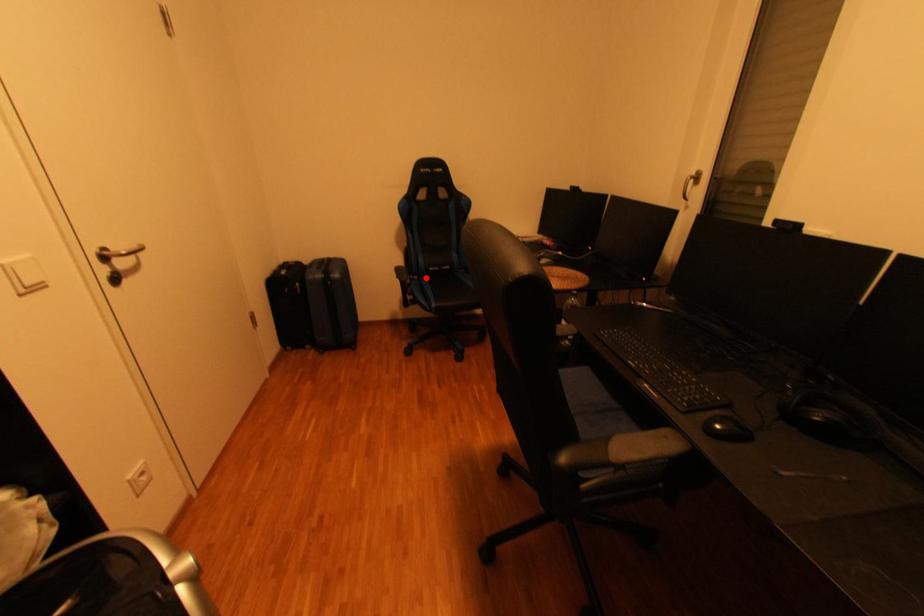
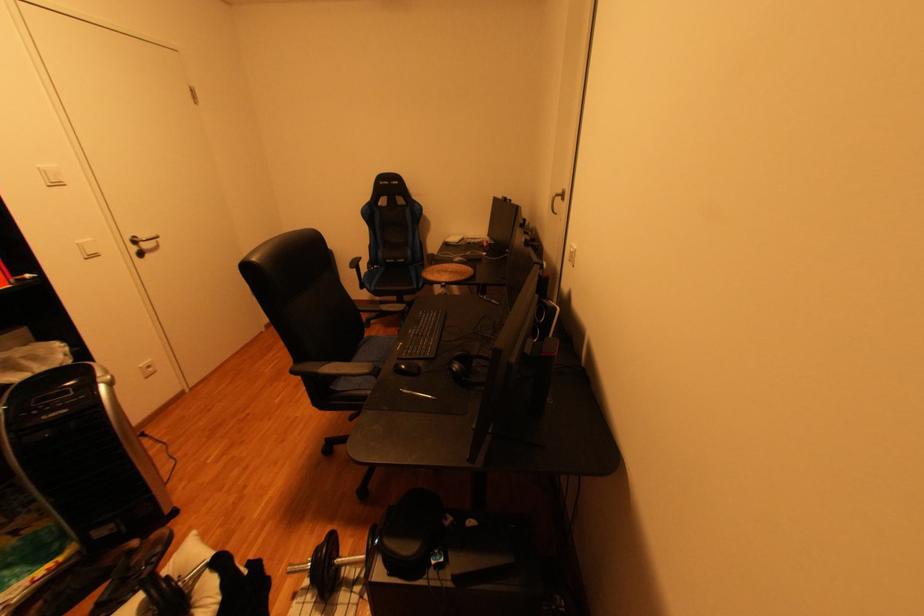
Find the pixel in the second image that matches the highlighted location in the first image.

(390, 267)